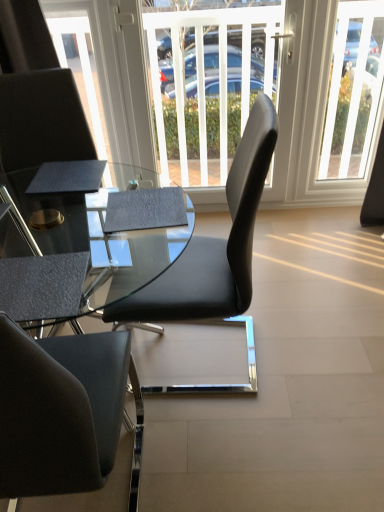
At what (x,y) coordinates should I click in order to perform the action: click on free point below black leather chair at center, the 1th chair viewed from the right (from a real-world perspective). Please return your answer as a coordinate pair (x, y). The image size is (384, 512). Looking at the image, I should click on (218, 357).